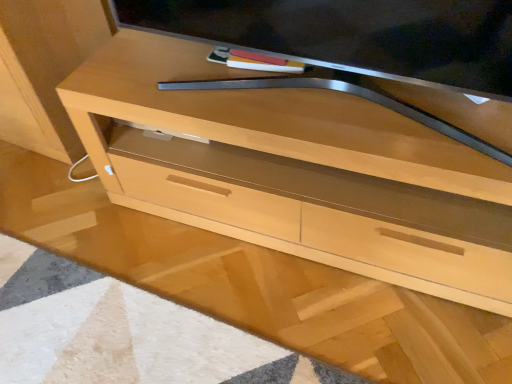
Question: Considering the positions of satin silver tv at upper center and light wood chest of drawers at center in the image, is satin silver tv at upper center bigger or smaller than light wood chest of drawers at center?

Choices:
 (A) big
 (B) small

Answer: (B)

Question: Is satin silver tv at upper center spatially inside light wood chest of drawers at center, or outside of it?

Choices:
 (A) outside
 (B) inside

Answer: (A)

Question: Considering the positions of point (178, 8) and point (324, 261), is point (178, 8) closer or farther from the camera than point (324, 261)?

Choices:
 (A) farther
 (B) closer

Answer: (B)

Question: From a real-world perspective, is light wood chest of drawers at center positioned above or below satin silver tv at upper center?

Choices:
 (A) above
 (B) below

Answer: (B)

Question: Is point (187, 142) closer or farther from the camera than point (465, 24)?

Choices:
 (A) farther
 (B) closer

Answer: (A)

Question: Based on their positions, is light wood chest of drawers at center located to the left or right of satin silver tv at upper center?

Choices:
 (A) right
 (B) left

Answer: (A)

Question: Considering their positions, is light wood chest of drawers at center located in front of or behind satin silver tv at upper center?

Choices:
 (A) behind
 (B) front

Answer: (A)